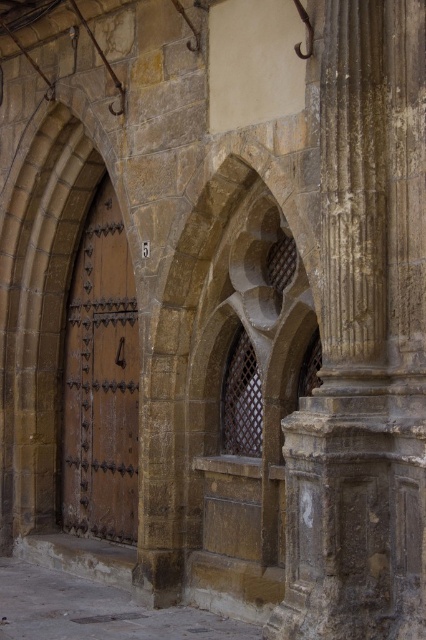
Is brown stone archway at center shorter than matte brown door at center?

Yes, brown stone archway at center is shorter than matte brown door at center.

This screenshot has width=426, height=640. I want to click on brown stone archway at center, so click(x=227, y=360).

Which of these two, brown stone column at right or brown stone archway at center, stands taller?

brown stone column at right

Is brown stone column at right above brown stone archway at center?

No.

Between point (405, 83) and point (264, 173), which one is positioned behind?

Point (264, 173)

Locate an element on the screen. brown stone column at right is located at coordinates (363, 344).

Who is more forward, (393, 4) or (69, 518)?

Positioned in front is point (393, 4).

Is the position of brown stone column at right less distant than that of matte brown door at center?

Yes, it is.

Locate an element on the screen. brown stone column at right is located at coordinates (363, 344).